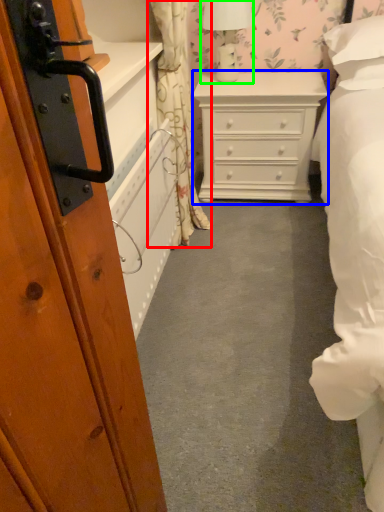
Question: Which object is positioned closest to curtain (highlighted by a red box)? Select from chest of drawers (highlighted by a blue box) and table lamp (highlighted by a green box).

Choices:
 (A) chest of drawers
 (B) table lamp

Answer: (A)